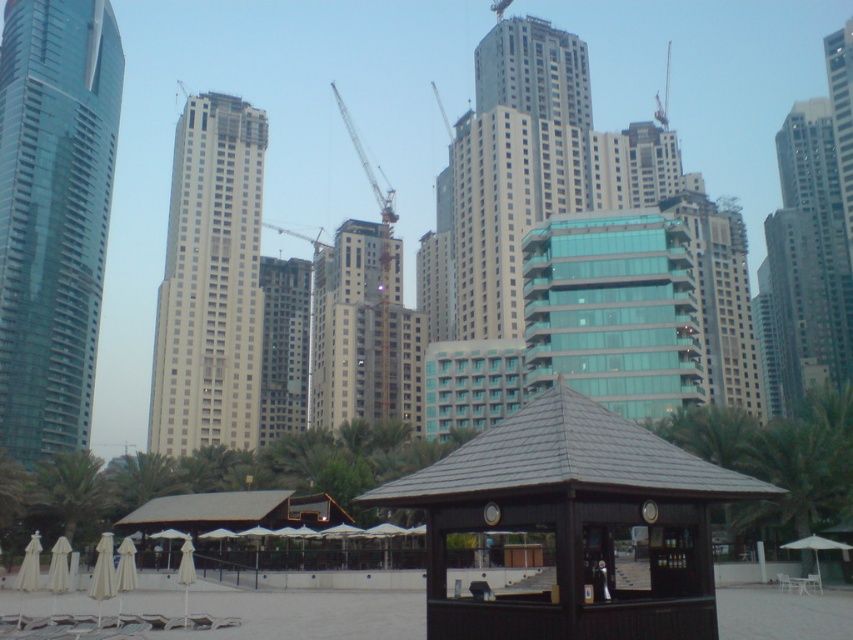
You are a city planner evaluating the beachfront area. You need to determine if the green leafy palm tree at lower left can be moved closer to the metallic gray crane at center without blocking its operation. Based on their sizes, is this feasible?

The green leafy palm tree at lower left is narrower than the metallic gray crane at center, so moving it closer should be feasible without blocking the crane.

You are a city planner evaluating the beachfront area. You need to ensure that the green leafy palm tree at center does not block the view of the white glass building at center from the beach. Based on the scene description, will the palm tree obstruct the view of the building?

The white glass building at center is taller than the green leafy palm tree at center, so the palm tree will not obstruct the view of the building from the beach.